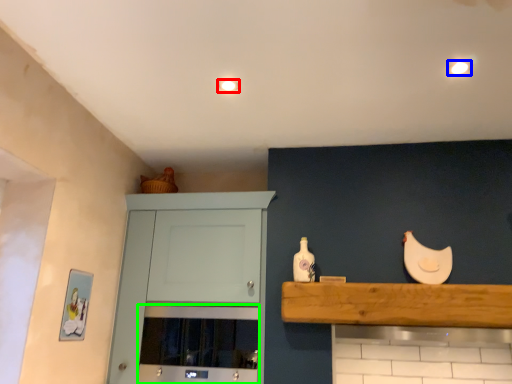
Question: Which object is positioned closest to lighting (highlighted by a red box)? Select from lighting (highlighted by a blue box) and oven (highlighted by a green box).

Choices:
 (A) lighting
 (B) oven

Answer: (A)